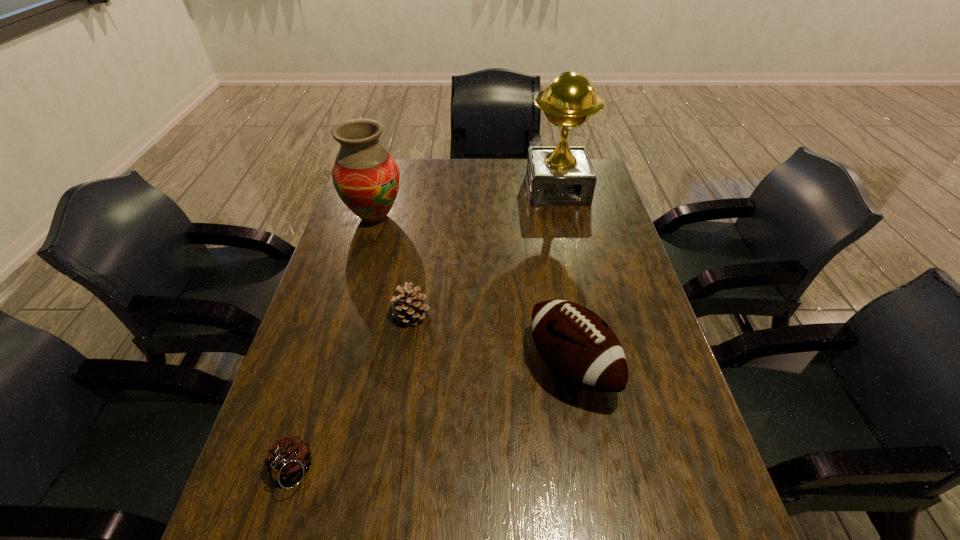
In the image, there is a desktop. Where is `free space at the right edge`? The image size is (960, 540). free space at the right edge is located at coordinates (699, 516).

The width and height of the screenshot is (960, 540). Identify the location of free region at the far right corner of the desktop. (601, 188).

This screenshot has height=540, width=960. I want to click on vacant area that lies between the football (American) and the fourth shortest object, so click(473, 292).

The height and width of the screenshot is (540, 960). In order to click on free space between the award and the vase in this screenshot , I will do `click(466, 203)`.

Locate an element on the screen. The width and height of the screenshot is (960, 540). vacant area between the farther pinecone and the tallest object is located at coordinates (485, 252).

You are a GUI agent. You are given a task and a screenshot of the screen. Output one action in this format:
    pyautogui.click(x=<x>, y=<y>)
    Task: Click on the empty location between the right pinecone and the left pinecone
    The height and width of the screenshot is (540, 960).
    Given the screenshot: What is the action you would take?
    pyautogui.click(x=351, y=393)

Locate an element on the screen. Image resolution: width=960 pixels, height=540 pixels. free space between the tallest object and the third shortest object is located at coordinates (564, 278).

What are the coordinates of `unoccupied position between the vase and the nearer pinecone` in the screenshot? It's located at (333, 344).

The width and height of the screenshot is (960, 540). I want to click on vacant area that lies between the award and the farther pinecone, so click(x=485, y=252).

I want to click on free space between the tallest object and the nearest object, so pyautogui.click(x=424, y=330).